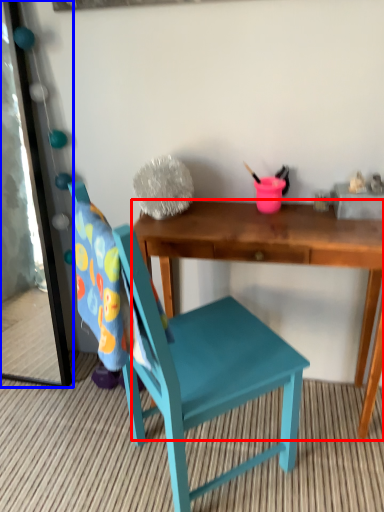
Question: Which object is closer to the camera taking this photo, desk (highlighted by a red box) or mirror (highlighted by a blue box)?

Choices:
 (A) desk
 (B) mirror

Answer: (A)